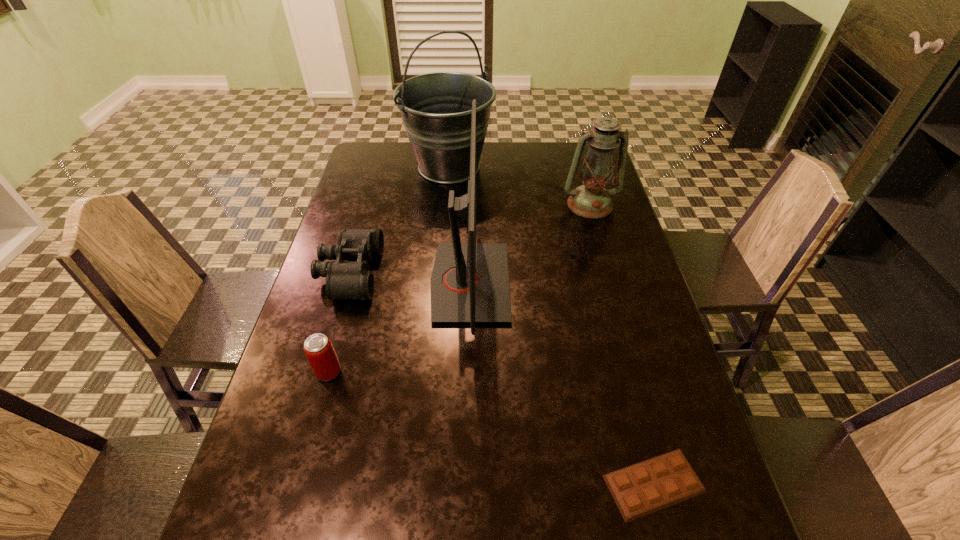
You are a GUI agent. You are given a task and a screenshot of the screen. Output one action in this format:
    pyautogui.click(x=<x>, y=<y>)
    Task: Click on the vacant space located 0.080m on the left of the beer can
    
    Given the screenshot: What is the action you would take?
    pyautogui.click(x=281, y=372)

Locate an element on the screen. free location located at the eyepieces of the binoculars is located at coordinates (478, 273).

Image resolution: width=960 pixels, height=540 pixels. In order to click on free space located 0.260m on the back of the nearest object in this screenshot , I will do `click(617, 343)`.

At what (x,y) coordinates should I click in order to perform the action: click on object at the far edge. Please return your answer as a coordinate pair (x, y). Looking at the image, I should click on (436, 108).

Locate an element on the screen. beer can present at the left edge is located at coordinates (318, 348).

In order to click on binoculars situated at the left edge in this screenshot , I will do point(344,279).

In order to click on oil lamp present at the right edge in this screenshot , I will do `click(591, 200)`.

At what (x,y) coordinates should I click in order to perform the action: click on chocolate bar present at the right edge. Please return your answer as a coordinate pair (x, y). Looking at the image, I should click on (646, 487).

You are a GUI agent. You are given a task and a screenshot of the screen. Output one action in this format:
    pyautogui.click(x=<x>, y=<y>)
    Task: Click on the vacant space at the far edge
    
    Given the screenshot: What is the action you would take?
    pyautogui.click(x=494, y=148)

What are the coordinates of `vacant space at the left edge of the desktop` in the screenshot? It's located at (340, 411).